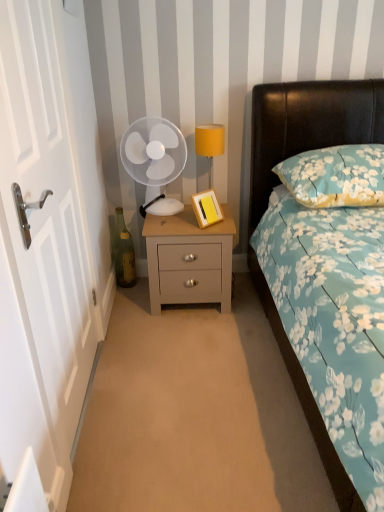
Question: Is matte gray nightstand at center in front of or behind white plastic mechanical fan at center in the image?

Choices:
 (A) front
 (B) behind

Answer: (B)

Question: From a real-world perspective, relative to white plastic mechanical fan at center, is matte gray nightstand at center vertically above or below?

Choices:
 (A) below
 (B) above

Answer: (A)

Question: Estimate the real-world distances between objects in this image. Which object is closer to the white wooden door at left?

Choices:
 (A) white plastic mechanical fan at center
 (B) floral fabric bed at right
 (C) floral fabric pillow at upper right
 (D) green glass bottle at left
 (E) yellow fabric lampshade at upper right

Answer: (A)

Question: Estimate the real-world distances between objects in this image. Which object is farther from the green glass bottle at left?

Choices:
 (A) yellow fabric lampshade at upper right
 (B) white plastic mechanical fan at center
 (C) floral fabric bed at right
 (D) floral fabric pillow at upper right
 (E) matte gray nightstand at center

Answer: (D)